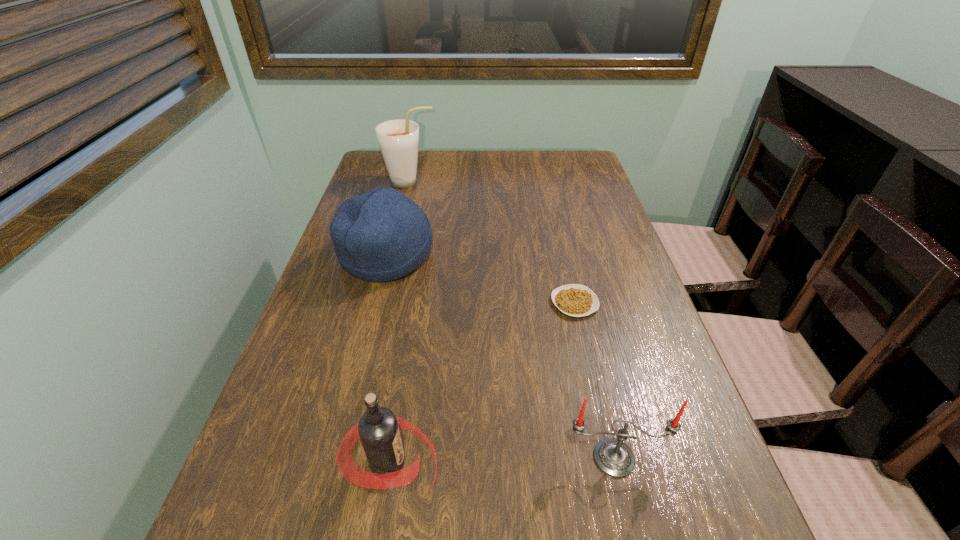
In order to click on the farther root beer in this screenshot , I will do `click(398, 139)`.

At what (x,y) coordinates should I click in order to perform the action: click on the taller root beer. Please return your answer as a coordinate pair (x, y). Looking at the image, I should click on (398, 139).

Identify the location of skullcap. This screenshot has height=540, width=960. (381, 235).

This screenshot has height=540, width=960. In order to click on the nearer root beer in this screenshot , I will do `click(378, 429)`.

Find the location of `candle`. candle is located at coordinates (613, 457).

Find the location of a particular element. Image resolution: width=960 pixels, height=540 pixels. the shortest object is located at coordinates (576, 300).

Locate an element on the screen. The width and height of the screenshot is (960, 540). vacant space located 0.250m on the drink side of the tallest object is located at coordinates (516, 182).

Locate an element on the screen. Image resolution: width=960 pixels, height=540 pixels. free space located 0.130m on the right of the skullcap is located at coordinates (485, 256).

Image resolution: width=960 pixels, height=540 pixels. I want to click on free space located 0.140m on the label of the shorter root beer, so click(525, 462).

Locate an element on the screen. vacant space located on the front-facing side of the candle is located at coordinates (628, 519).